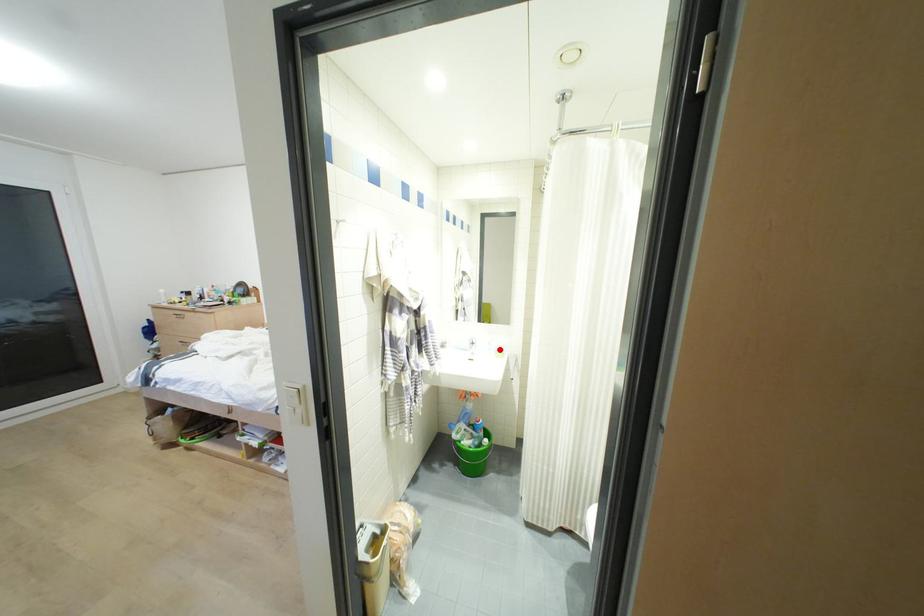
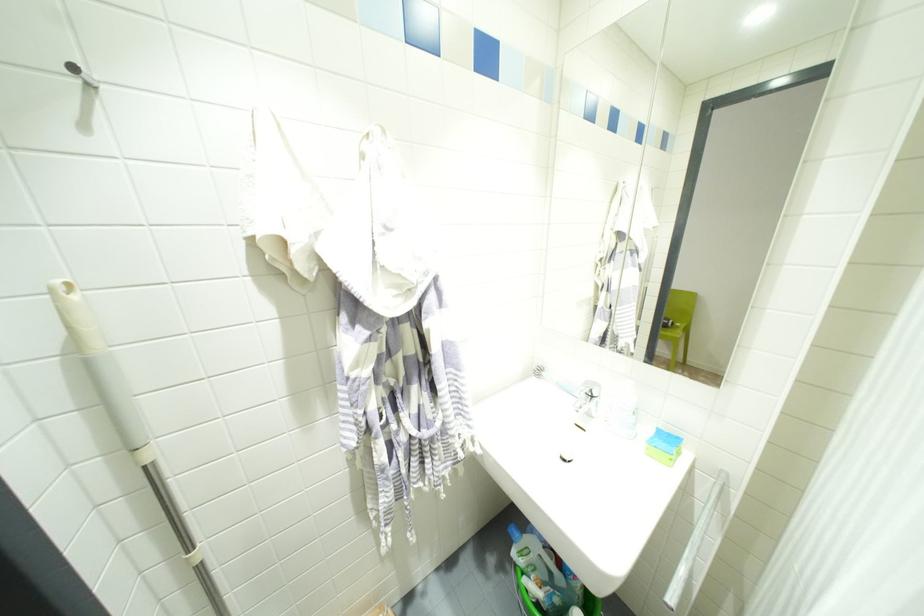
Locate, in the second image, the point that corresponds to the highlighted location in the first image.

(667, 439)